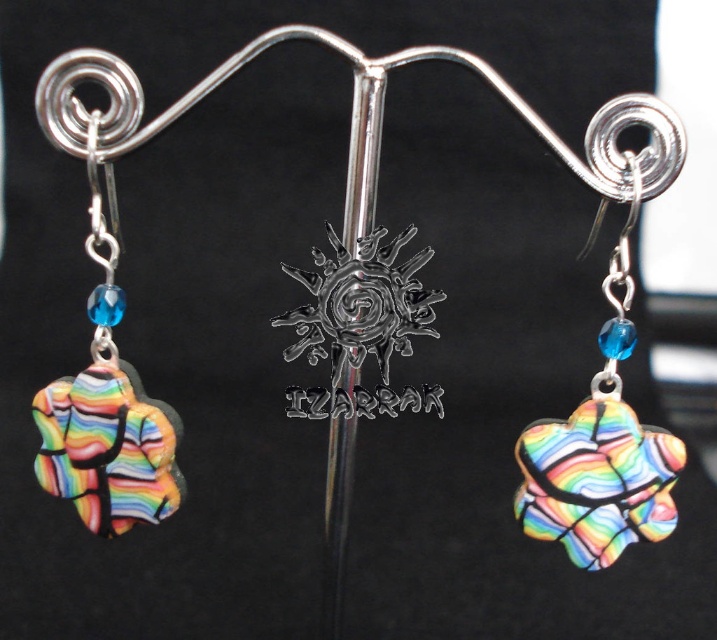
You are holding a camera 1.5 meters away from the point at coordinates point (617, 348). If you want to take a photo of the earrings displayed on the silver stand, will the point be in focus if your camera has a depth of field that can focus on objects between 0.9 meters and 1.1 meters away?

The point (617, 348) is 1.00 meters away from the camera. Since the camera can focus on objects between 0.9 meters and 1.1 meters away, the point will be in focus.

What are the coordinates of the rainbow glass heart at center?

The rainbow glass heart at center is located at point coordinates of (607, 385).